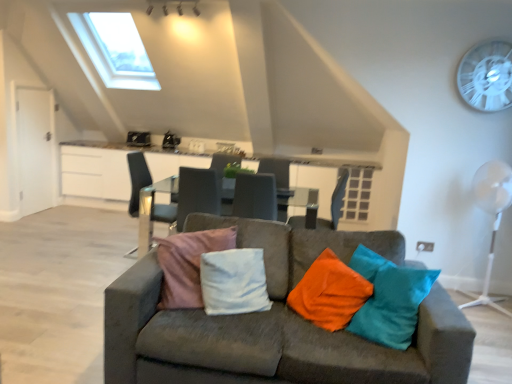
Question: Is metallic silver chair at center, the second chair from the right, inside the boundaries of transparent plastic fan at upper right, or outside?

Choices:
 (A) inside
 (B) outside

Answer: (B)

Question: Based on their sizes in the image, would you say metallic silver chair at center, the first chair when ordered from left to right, is bigger or smaller than transparent plastic fan at upper right?

Choices:
 (A) small
 (B) big

Answer: (B)

Question: Which is farther from the matte gray chair at center, which appears as the first chair when viewed from the right?

Choices:
 (A) transparent plastic fan at upper right
 (B) white plastic mechanical fan at right
 (C) velvet grey couch at center
 (D) metallic silver chair at center, the first chair when ordered from left to right

Answer: (C)

Question: Which of these objects is positioned farthest from the metallic silver chair at center, the first chair when ordered from left to right?

Choices:
 (A) matte gray chair at center, which appears as the first chair when viewed from the right
 (B) transparent plastic fan at upper right
 (C) white plastic mechanical fan at right
 (D) velvet grey couch at center

Answer: (B)